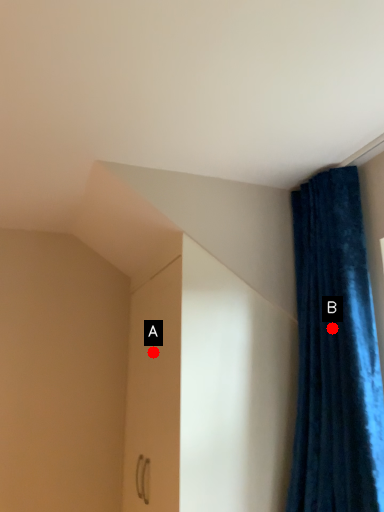
Question: Two points are circled on the image, labeled by A and B beside each circle. Which of the following is the closest to the observer?

Choices:
 (A) A is closer
 (B) B is closer

Answer: (B)